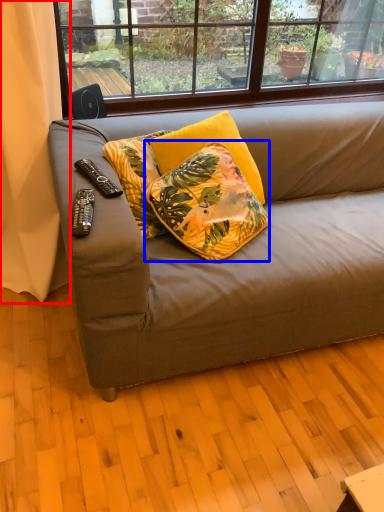
Question: Among these objects, which one is farthest to the camera, curtain (highlighted by a red box) or pillow (highlighted by a blue box)?

Choices:
 (A) curtain
 (B) pillow

Answer: (B)